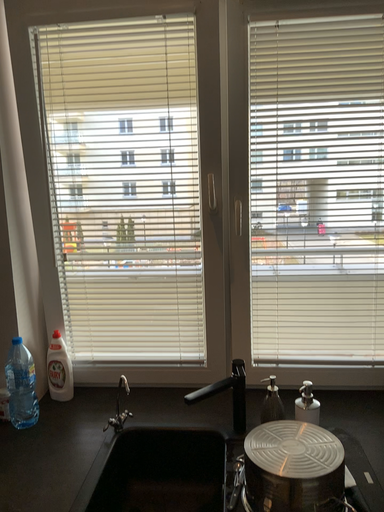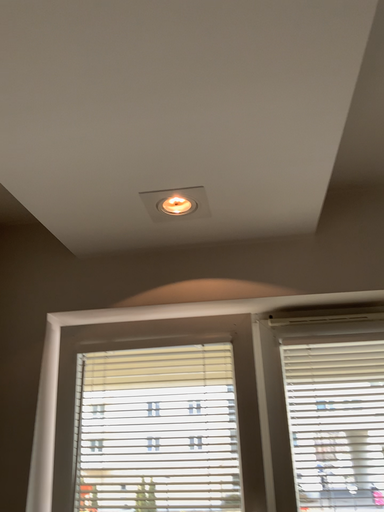
Question: Which way did the camera rotate in the video?

Choices:
 (A) rotated upward
 (B) rotated downward

Answer: (A)